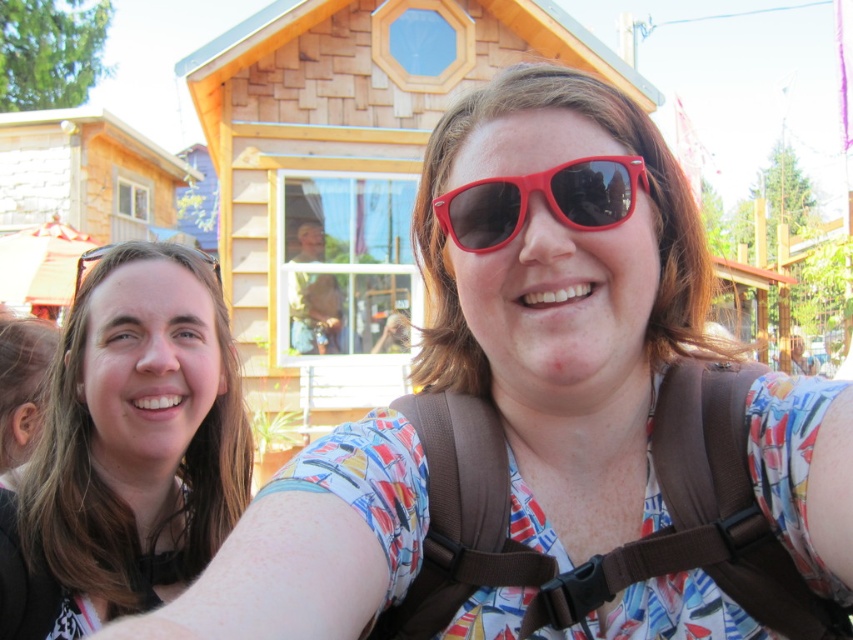
Does matte black hair at left appear under brown fabric strap at center?

Incorrect, matte black hair at left is not positioned below brown fabric strap at center.

Does matte black hair at left lie in front of brown fabric strap at center?

No, matte black hair at left is further to the viewer.

I want to click on matte black hair at left, so click(135, 440).

Locate an element on the screen. matte black hair at left is located at coordinates 135,440.

Can you confirm if brown fabric strap at center is taller than matte black sunglasses at left?

No, brown fabric strap at center is not taller than matte black sunglasses at left.

Can you confirm if brown fabric strap at center is positioned above matte black sunglasses at left?

No, brown fabric strap at center is not above matte black sunglasses at left.

The image size is (853, 640). What do you see at coordinates (618, 547) in the screenshot?
I see `brown fabric strap at center` at bounding box center [618, 547].

This screenshot has width=853, height=640. I want to click on brown fabric strap at center, so click(618, 547).

Is wooden cabin at center thinner than brown fabric strap at center?

Yes, wooden cabin at center is thinner than brown fabric strap at center.

Who is more forward, (281, 1) or (693, 540)?

Point (693, 540) is in front.

This screenshot has height=640, width=853. Identify the location of wooden cabin at center. (346, 173).